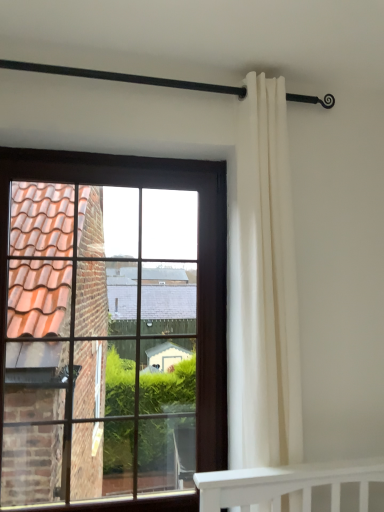
What do you see at coordinates (104, 338) in the screenshot?
I see `brown wooden window at left` at bounding box center [104, 338].

This screenshot has height=512, width=384. What do you see at coordinates (122, 77) in the screenshot?
I see `black metal rod at upper center` at bounding box center [122, 77].

Find the location of a particular element. This screenshot has height=512, width=384. white fabric curtain at right is located at coordinates (267, 280).

Locate an element on the screen. The height and width of the screenshot is (512, 384). brown wooden window at left is located at coordinates (104, 338).

From the image's perspective, who appears lower, brown wooden window at left or black metal rod at upper center?

brown wooden window at left, from the image's perspective.

Who is bigger, brown wooden window at left or black metal rod at upper center?

With larger size is brown wooden window at left.

Considering the sizes of objects brown wooden window at left and black metal rod at upper center in the image provided, who is taller, brown wooden window at left or black metal rod at upper center?

With more height is brown wooden window at left.

How different are the orientations of brown wooden window at left and black metal rod at upper center in degrees?

They differ by 1.21 degrees in their facing directions.

Considering the sizes of objects black metal rod at upper center and white fabric curtain at right in the image provided, who is shorter, black metal rod at upper center or white fabric curtain at right?

Standing shorter between the two is black metal rod at upper center.

Is the position of black metal rod at upper center less distant than that of white fabric curtain at right?

Yes, it is.

From the image's perspective, who appears lower, black metal rod at upper center or white fabric curtain at right?

white fabric curtain at right, from the image's perspective.

From a real-world perspective, between black metal rod at upper center and white fabric curtain at right, who is vertically lower?

white fabric curtain at right, from a real-world perspective.

Based on the photo, does white fabric curtain at right have a lesser height compared to black metal rod at upper center?

Incorrect, the height of white fabric curtain at right does not fall short of that of black metal rod at upper center.

Is white fabric curtain at right in front of or behind black metal rod at upper center in the image?

white fabric curtain at right is positioned farther from the viewer than black metal rod at upper center.

Which is correct: white fabric curtain at right is inside black metal rod at upper center, or outside of it?

white fabric curtain at right is not enclosed by black metal rod at upper center.

Based on the photo, from a real-world perspective, between white fabric curtain at right and brown wooden window at left, who is vertically higher?

In real-world perspective, white fabric curtain at right is above.

In order to click on curtain above the brown wooden window at left (from a real-world perspective) in this screenshot , I will do `click(267, 280)`.

How different are the orientations of white fabric curtain at right and brown wooden window at left in degrees?

The facing directions of white fabric curtain at right and brown wooden window at left are 1.47 degrees apart.

Which is behind, point (238, 412) or point (38, 226)?

The point (38, 226) is farther from the camera.

In the scene shown: Between brown wooden window at left and white fabric curtain at right, which one has less height?

brown wooden window at left is shorter.

From a real-world perspective, is brown wooden window at left positioned above or below white fabric curtain at right?

From a real-world perspective, brown wooden window at left is physically below white fabric curtain at right.

Would you consider brown wooden window at left to be distant from white fabric curtain at right?

brown wooden window at left is far away from white fabric curtain at right.

From the image's perspective, is black metal rod at upper center above or below brown wooden window at left?

Clearly, from the image's perspective, black metal rod at upper center is above brown wooden window at left.

Which of these two, black metal rod at upper center or brown wooden window at left, is smaller?

black metal rod at upper center is smaller.

Consider the image. From a real-world perspective, which object stands above the other?

black metal rod at upper center, from a real-world perspective.

Does black metal rod at upper center have a lesser height compared to brown wooden window at left?

Indeed, black metal rod at upper center has a lesser height compared to brown wooden window at left.

The height and width of the screenshot is (512, 384). There is a brown wooden window at left. In order to click on balustrade above it (from a real-world perspective) in this screenshot , I will do `click(122, 77)`.

Locate an element on the screen. curtain on the right of the black metal rod at upper center is located at coordinates (267, 280).

Looking at the image, which one is located further to brown wooden window at left, black metal rod at upper center or white fabric curtain at right?

black metal rod at upper center is positioned further to the anchor brown wooden window at left.

Estimate the real-world distances between objects in this image. Which object is closer to black metal rod at upper center, brown wooden window at left or white fabric curtain at right?

Among the two, white fabric curtain at right is located nearer to black metal rod at upper center.

Which object lies nearer to the anchor point white fabric curtain at right, black metal rod at upper center or brown wooden window at left?

Based on the image, black metal rod at upper center appears to be nearer to white fabric curtain at right.

From the image, which object appears to be nearer to black metal rod at upper center, white fabric curtain at right or brown wooden window at left?

Based on the image, white fabric curtain at right appears to be nearer to black metal rod at upper center.

Considering their positions, is brown wooden window at left positioned further to white fabric curtain at right than black metal rod at upper center?

brown wooden window at left is positioned further to the anchor white fabric curtain at right.

From the picture: Estimate the real-world distances between objects in this image. Which object is closer to brown wooden window at left, white fabric curtain at right or black metal rod at upper center?

white fabric curtain at right.

You are a GUI agent. You are given a task and a screenshot of the screen. Output one action in this format:
    pyautogui.click(x=<x>, y=<y>)
    Task: Click on the curtain between black metal rod at upper center and brown wooden window at left from top to bottom
    This screenshot has height=512, width=384.
    Given the screenshot: What is the action you would take?
    pyautogui.click(x=267, y=280)